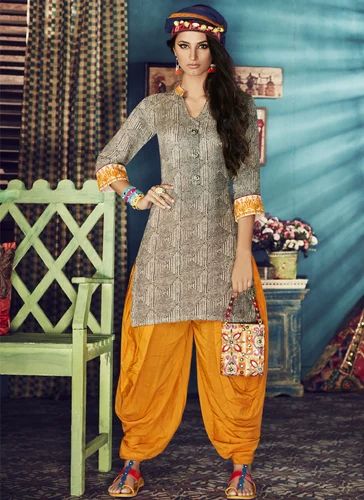
This screenshot has width=364, height=500. I want to click on floor, so coord(298,461).